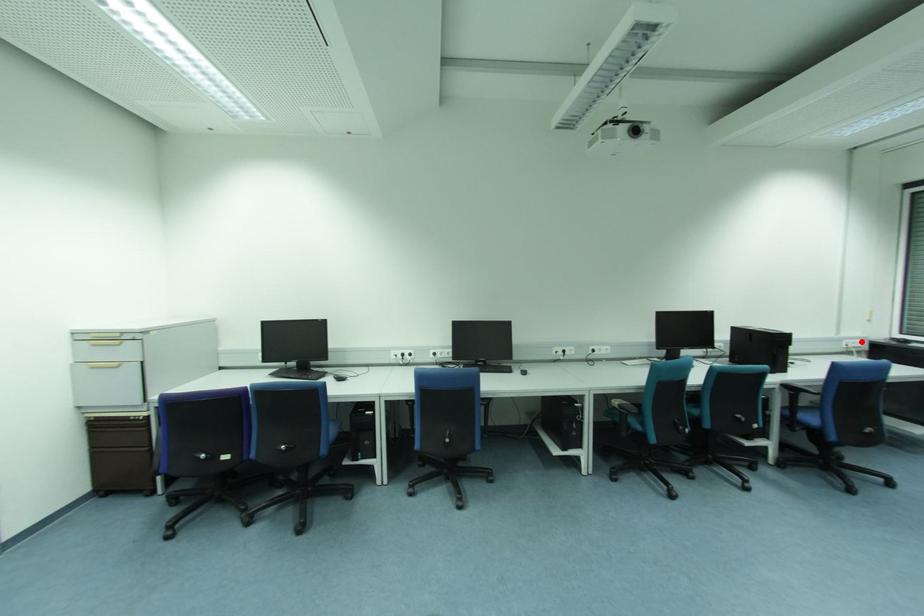
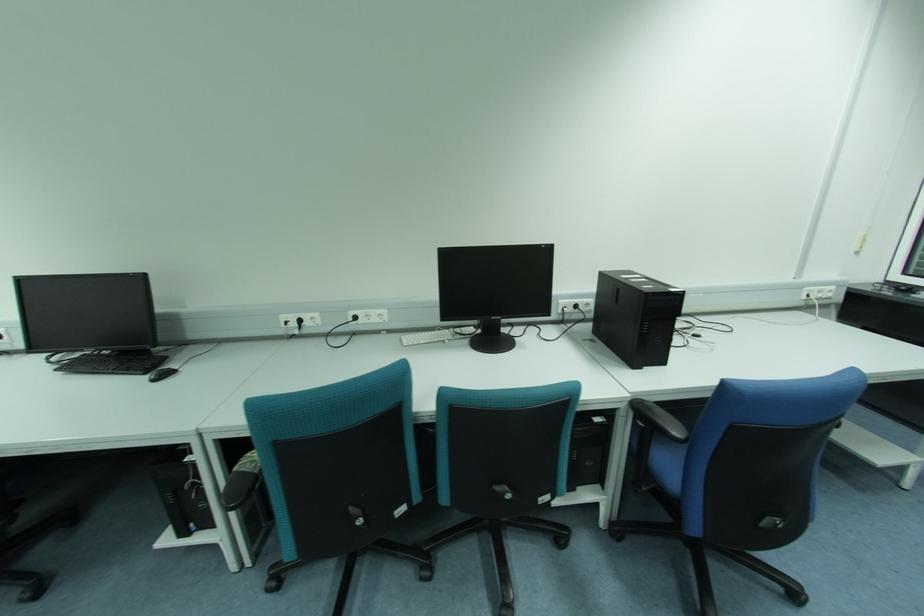
Find the pixel in the second image that matches the highlighted location in the first image.

(833, 288)